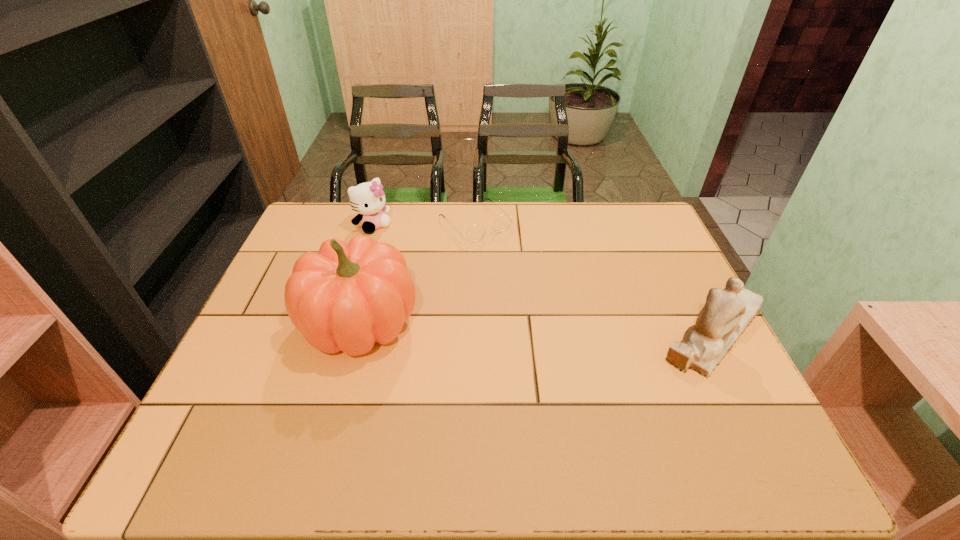
The width and height of the screenshot is (960, 540). In the image, there is a desktop. In order to click on vacant space at the far left corner in this screenshot , I will do `click(347, 215)`.

Locate an element on the screen. The image size is (960, 540). empty location between the rightmost object and the tallest object is located at coordinates (538, 326).

Find the location of a particular element. This screenshot has height=540, width=960. unoccupied area between the figurine and the kitten is located at coordinates (544, 278).

Locate an element on the screen. The image size is (960, 540). blank region between the spectacles and the rightmost object is located at coordinates (595, 277).

Locate an element on the screen. The height and width of the screenshot is (540, 960). free spot between the figurine and the third object from left to right is located at coordinates (595, 277).

Where is `free space between the spectacles and the kitten`? free space between the spectacles and the kitten is located at coordinates (424, 225).

You are a GUI agent. You are given a task and a screenshot of the screen. Output one action in this format:
    pyautogui.click(x=<x>, y=<y>)
    Task: Click on the free space between the rightmost object and the kitten
    The image size is (960, 540).
    Given the screenshot: What is the action you would take?
    544,278

Identify the location of free spot between the rightmost object and the shortest object. This screenshot has height=540, width=960. (595, 277).

You are a GUI agent. You are given a task and a screenshot of the screen. Output one action in this format:
    pyautogui.click(x=<x>, y=<y>)
    Task: Click on the free space between the tallest object and the third object from left to right
    
    Given the screenshot: What is the action you would take?
    pyautogui.click(x=418, y=273)

The image size is (960, 540). What are the coordinates of `object that ranks as the third closest to the pumpkin` in the screenshot? It's located at (727, 312).